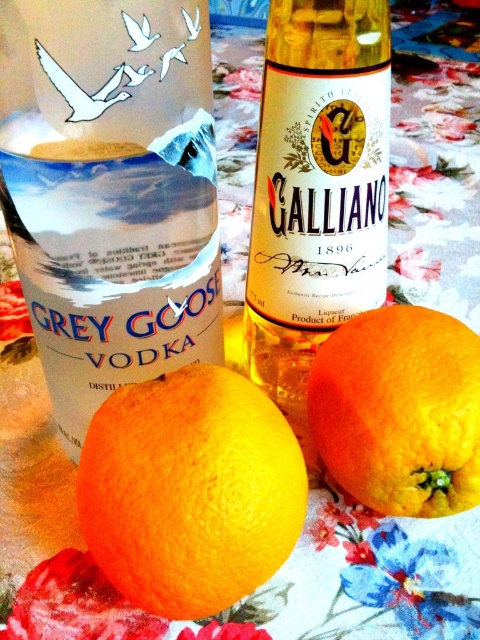
Question: Which point is closer to the camera taking this photo?

Choices:
 (A) (116, 461)
 (B) (73, 88)
 (C) (358, 365)
 (D) (307, 371)

Answer: (B)

Question: Does yellow glass bottle at center have a smaller size compared to orangesmoothorange at right?

Choices:
 (A) no
 (B) yes

Answer: (A)

Question: Which object is the closest to the orangesmoothorange at right?

Choices:
 (A) yellow matte/orange at center
 (B) clear glass bottle at lower left
 (C) yellow glass bottle at center

Answer: (A)

Question: Which is nearer to the yellow glass bottle at center?

Choices:
 (A) clear glass bottle at lower left
 (B) yellow matte/orange at center
 (C) orangesmoothorange at right

Answer: (C)

Question: Can you confirm if yellow glass bottle at center is positioned above orangesmoothorange at right?

Choices:
 (A) yes
 (B) no

Answer: (A)

Question: Is yellow glass bottle at center below yellow matte/orange at center?

Choices:
 (A) no
 (B) yes

Answer: (A)